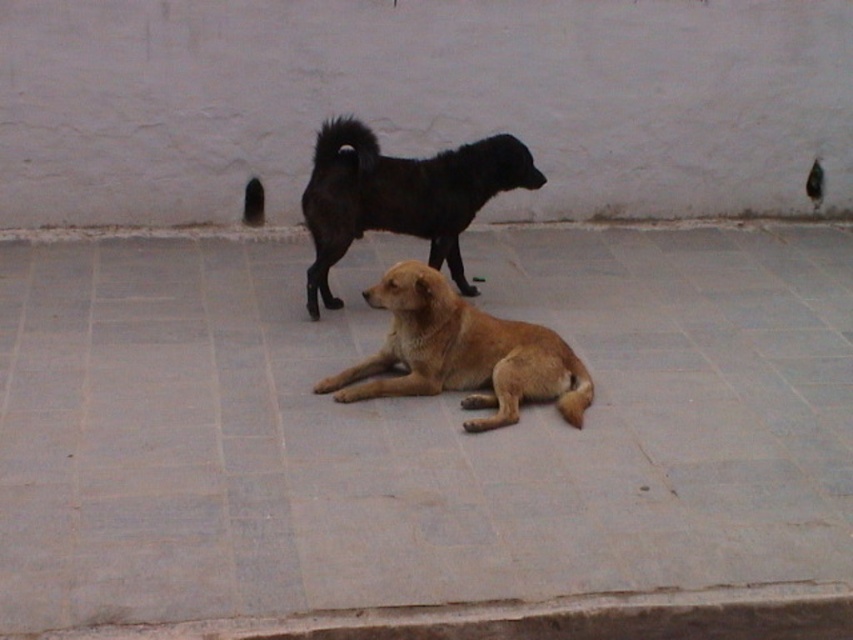
Can you confirm if gray concrete pavement at center is smaller than golden fur dog at center?

Actually, gray concrete pavement at center might be larger than golden fur dog at center.

Is point (15, 243) farther from viewer compared to point (370, 301)?

That is True.

This screenshot has height=640, width=853. Identify the location of gray concrete pavement at center. (415, 428).

What do you see at coordinates (415, 428) in the screenshot? I see `gray concrete pavement at center` at bounding box center [415, 428].

Is point (763, 524) positioned after point (439, 208)?

No, (763, 524) is in front of (439, 208).

At what (x,y) coordinates should I click in order to perform the action: click on gray concrete pavement at center. Please return your answer as a coordinate pair (x, y). The height and width of the screenshot is (640, 853). Looking at the image, I should click on (415, 428).

Is golden fur dog at center shorter than shiny black dog at center?

Yes, golden fur dog at center is shorter than shiny black dog at center.

Is golden fur dog at center to the left of shiny black dog at center from the viewer's perspective?

Incorrect, golden fur dog at center is not on the left side of shiny black dog at center.

Where is `golden fur dog at center`? The width and height of the screenshot is (853, 640). golden fur dog at center is located at coordinates (461, 353).

Find the location of a particular element. The width and height of the screenshot is (853, 640). golden fur dog at center is located at coordinates (461, 353).